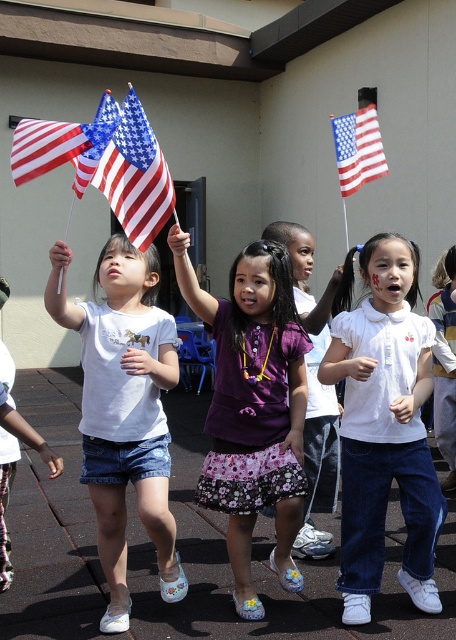
Looking at this image, does american flag at upper center have a smaller size compared to american flag at left?

No, american flag at upper center is not smaller than american flag at left.

Who is higher up, american flag at upper center or american flag at left?

american flag at upper center is higher up.

Which is in front, point (347, 132) or point (102, 132)?

Positioned in front is point (102, 132).

The image size is (456, 640). Identify the location of american flag at upper center. (357, 148).

Is point (91, 346) more distant than point (112, 132)?

That is True.

Between white matte t-shirt at center and american flag at left, which one has less height?

With less height is american flag at left.

Is point (108, 564) less distant than point (94, 141)?

No, (108, 564) is further to viewer.

Find the location of a particular element. white matte t-shirt at center is located at coordinates (124, 410).

Is matte fabric flag at upper left shorter than american flag at left?

No.

Is matte fabric flag at upper left further to the viewer compared to american flag at left?

Yes, it is.

Is point (119, 179) in front of point (88, 131)?

No, (119, 179) is further to viewer.

The image size is (456, 640). In order to click on matte fabric flag at upper left in this screenshot , I will do `click(135, 176)`.